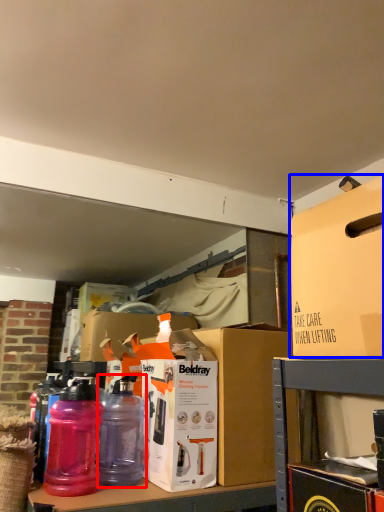
Question: Which object appears closest to the camera in this image, bottle (highlighted by a red box) or box (highlighted by a blue box)?

Choices:
 (A) bottle
 (B) box

Answer: (B)